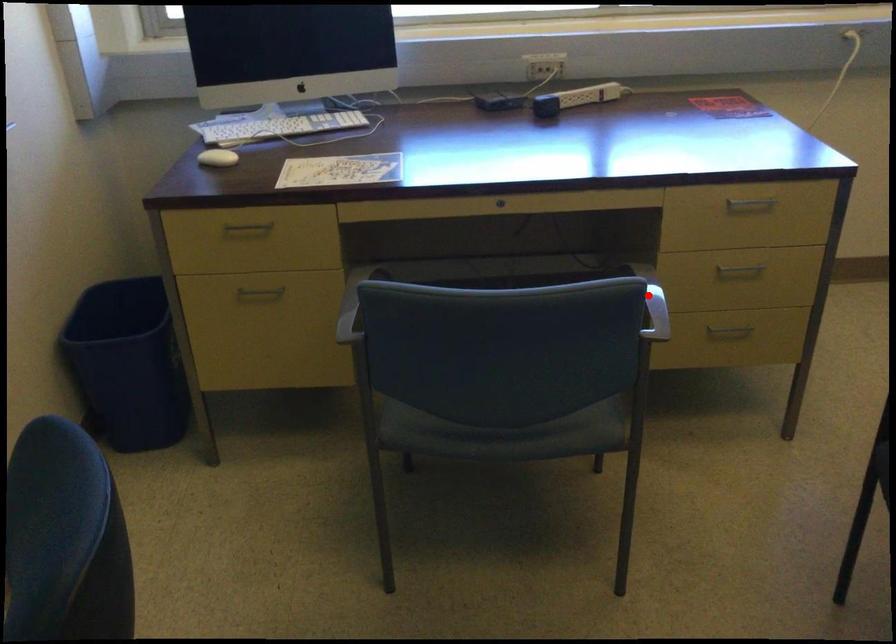
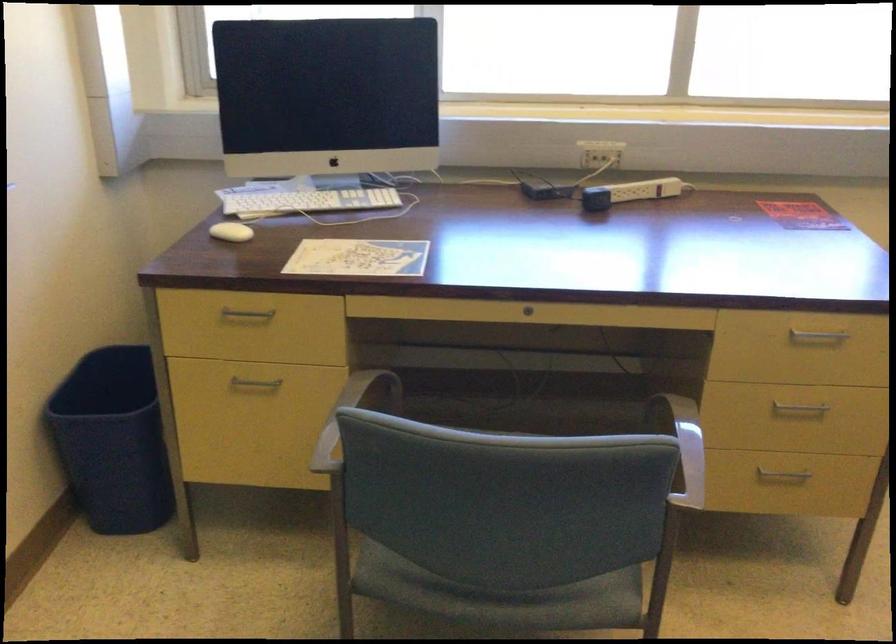
In the second image, find the point that corresponds to the highlighted location in the first image.

(684, 446)